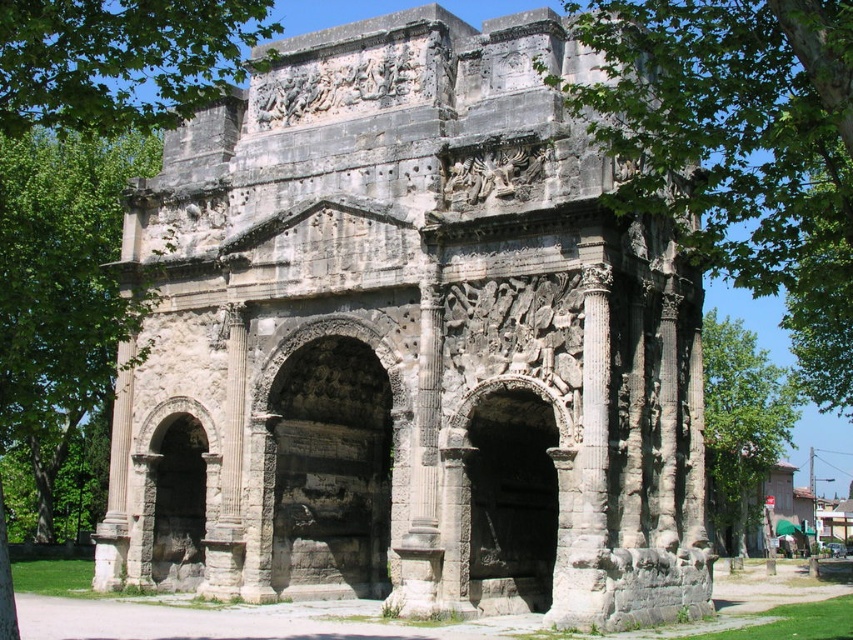
Question: Does green leafy tree at upper left appear on the right side of green leafy tree at center?

Choices:
 (A) no
 (B) yes

Answer: (A)

Question: Which point is closer to the camera?

Choices:
 (A) (100, 0)
 (B) (728, 467)
 (C) (796, 240)

Answer: (A)

Question: Considering the real-world distances, which object is farthest from the gray stone archway at center?

Choices:
 (A) green leafy tree at upper left
 (B) rough stone archway at center

Answer: (A)

Question: Is gray stone arch at center positioned at the back of green leafy tree at upper left?

Choices:
 (A) yes
 (B) no

Answer: (A)

Question: Which object is the closest to the rough stone archway at center?

Choices:
 (A) green leafy tree at upper left
 (B) green leafy tree at left

Answer: (B)

Question: Is gray stone arch at center smaller than gray stone archway at center?

Choices:
 (A) yes
 (B) no

Answer: (B)